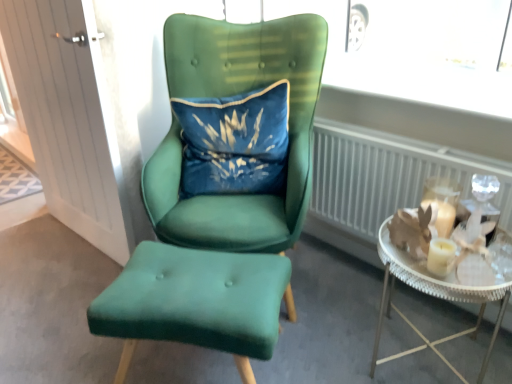
Identify the location of free point below metallic silver tray at right (from a real-world perspective). The image size is (512, 384). (426, 350).